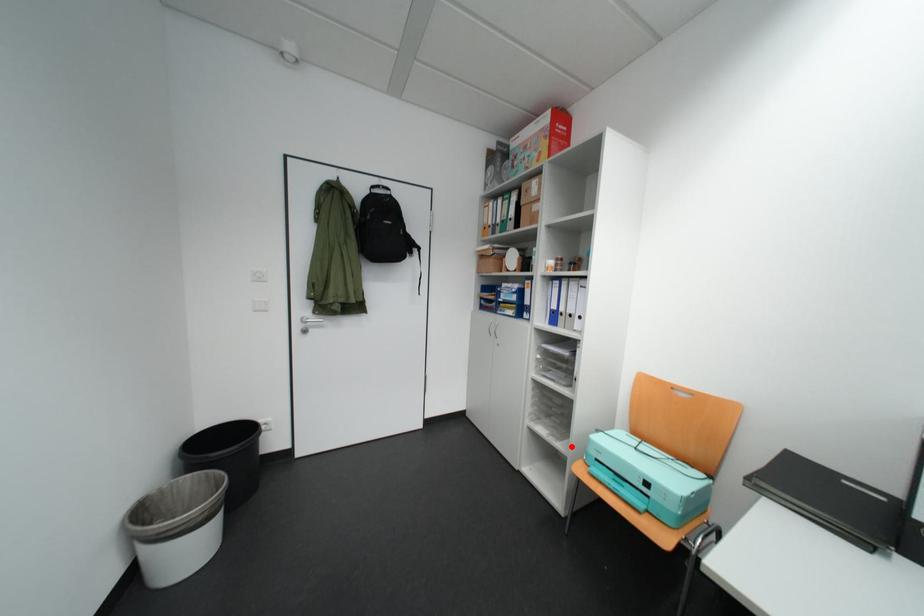
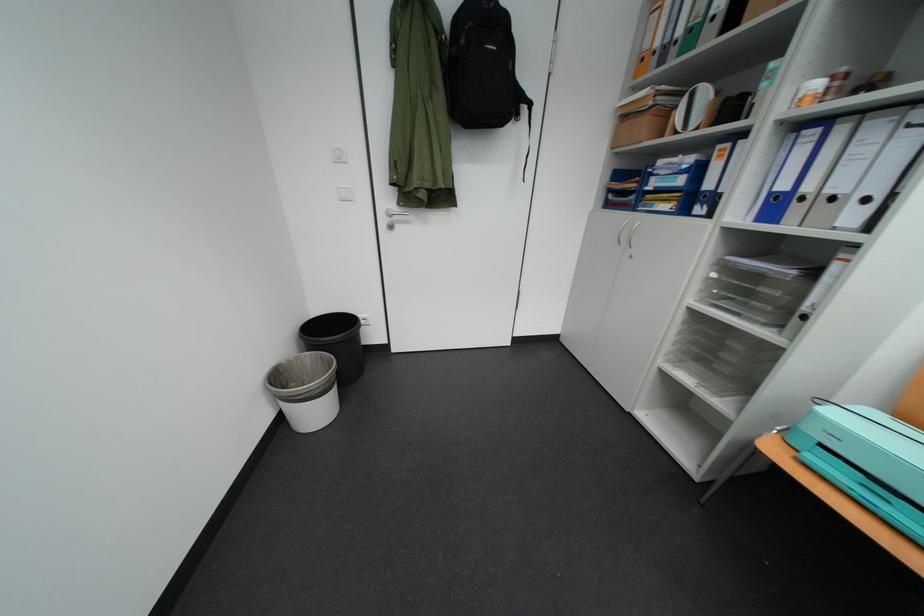
Question: A red point is marked in image1. In image2, is the corresponding 3D point closer to the camera or farther? Reply with the corresponding letter.

Choices:
 (A) The corresponding 3D point is closer.
 (B) The corresponding 3D point is farther.

Answer: (A)